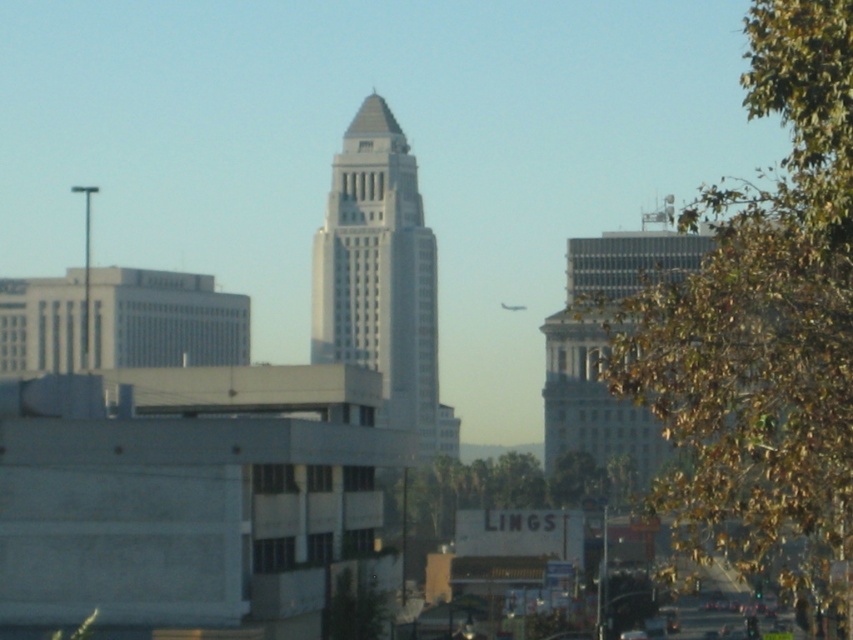
You are standing in the city and want to reach a specific location marked by point (611,390). If you walk straight ahead, will you reach this point within 25 meters?

The distance between point (611,390) and the viewer is 22.04 meters, so yes, you can reach it within 25 meters by walking straight ahead.

You are a photographer wanting to capture the white smooth tower at center without any obstructions. Given the green leafy tree at upper right is blocking part of the tower, can you adjust your position to avoid the tree?

The green leafy tree at upper right is in front of the white smooth tower at center, so moving your position to the left or right might allow you to frame the shot without the tree obstructing the tower.